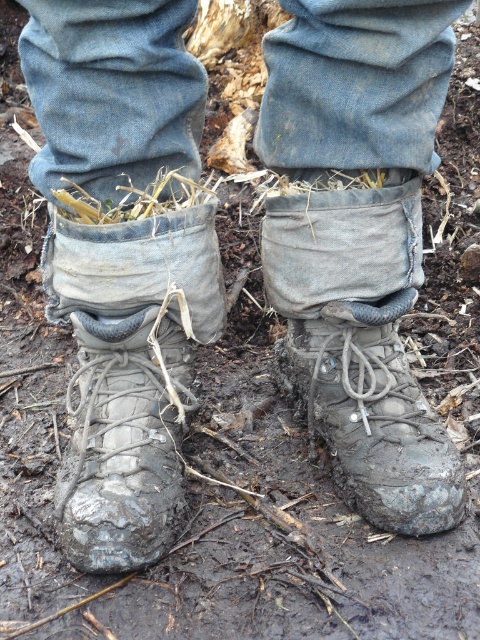
You are a hiker who just arrived at a muddy trail. You see a muddy rubber boot at lower left and brown straw at center. Which object is closer to the ground?

The muddy rubber boot at lower left is located below brown straw at center, so it is closer to the ground.

You are a photographer trying to capture the texture of the muddy ground between the muddy rubber boot at center and the brown straw at center. Which object should you focus on first to ensure the muddy ground is in sharp focus?

The muddy rubber boot at center is closer to you than the brown straw at center. To ensure the muddy ground between them is in focus, you should focus on the muddy rubber boot at center first, as it is closer and the focus will naturally extend to the background towards the brown straw at center.